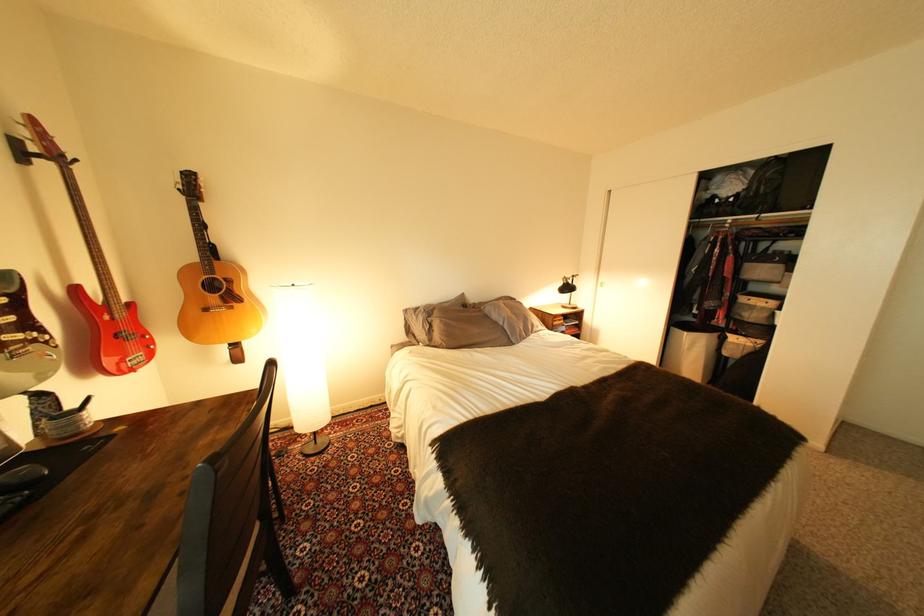
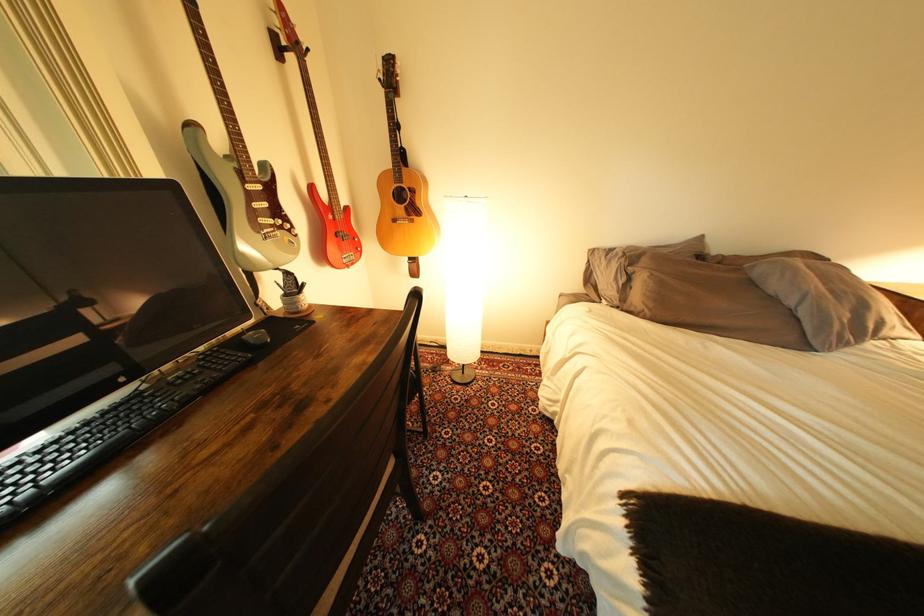
In the second image, find the point that corresponds to point 477,345 in the first image.

(701, 322)